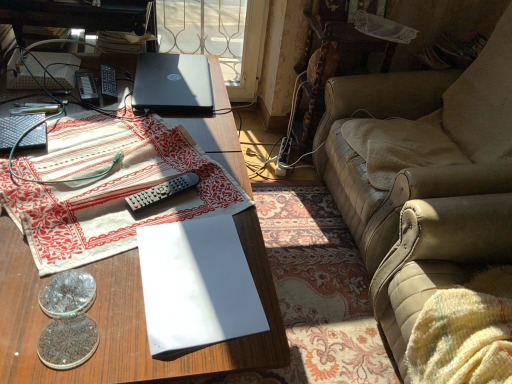
What are the coordinates of `free area below satin black laptop at upper center (from a real-world perspective)` in the screenshot? It's located at (178, 82).